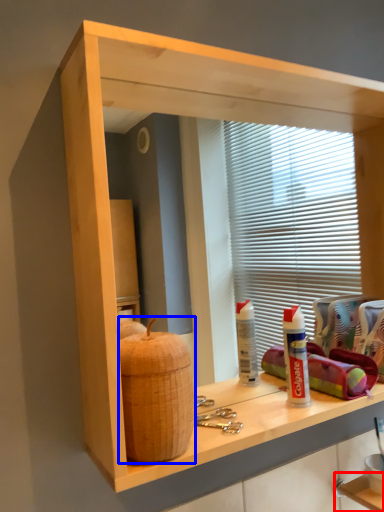
Question: Which of the following is the closest to the observer, shelf (highlighted by a red box) or basket (highlighted by a blue box)?

Choices:
 (A) shelf
 (B) basket

Answer: (B)